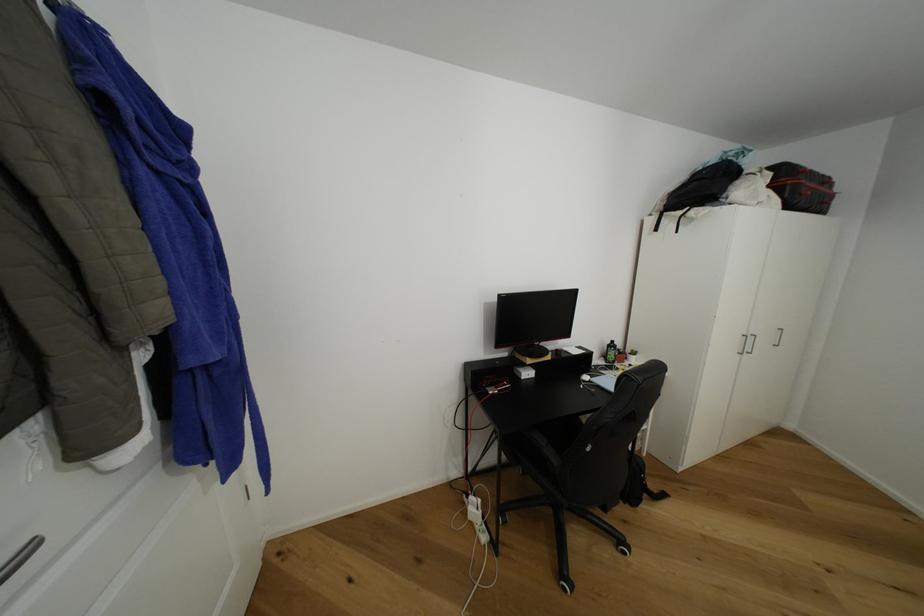
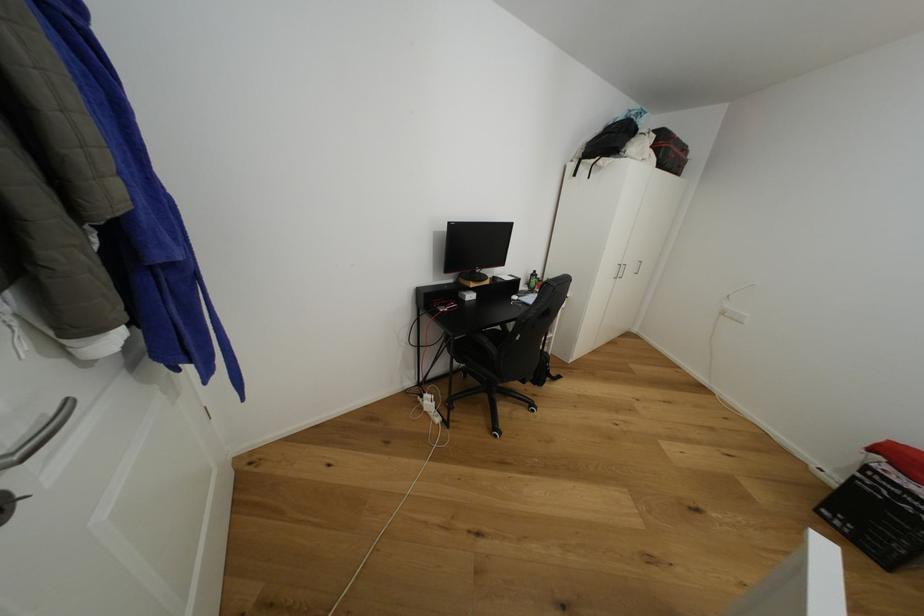
Question: How did the camera likely rotate?

Choices:
 (A) Left
 (B) Right
 (C) Up
 (D) Down

Answer: (B)